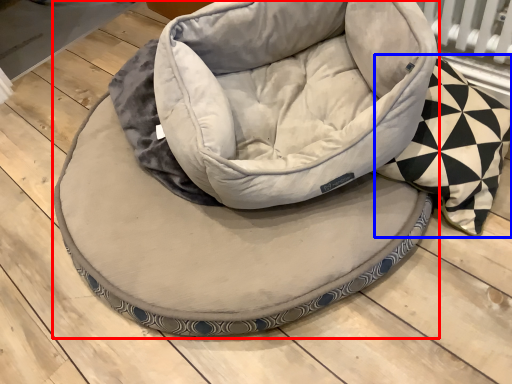
Question: Which object appears farthest to the camera in this image, dog bed (highlighted by a red box) or throw pillow (highlighted by a blue box)?

Choices:
 (A) dog bed
 (B) throw pillow

Answer: (A)